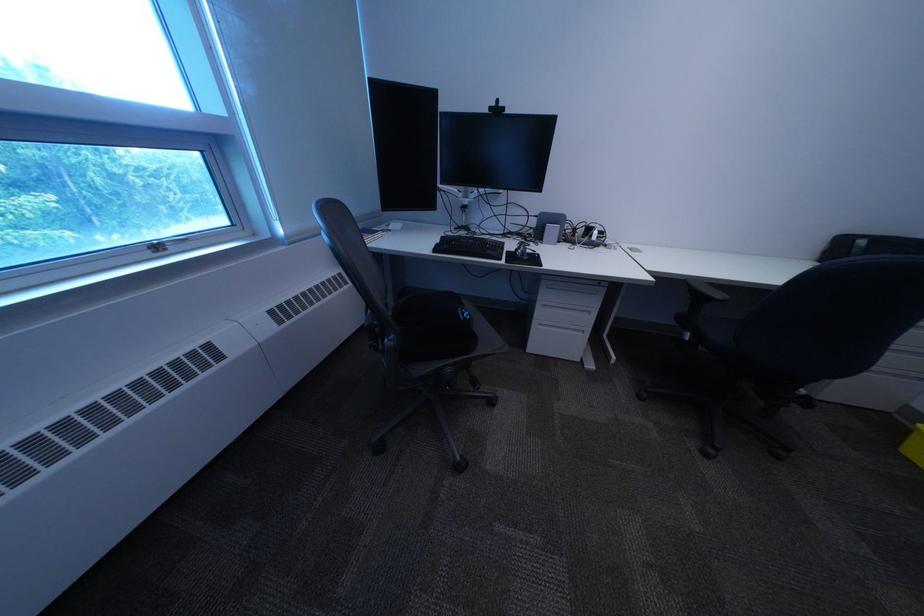
Where would you pull the cabinet drawer pull? Please return your answer as a coordinate pair (x, y).

(565, 313)